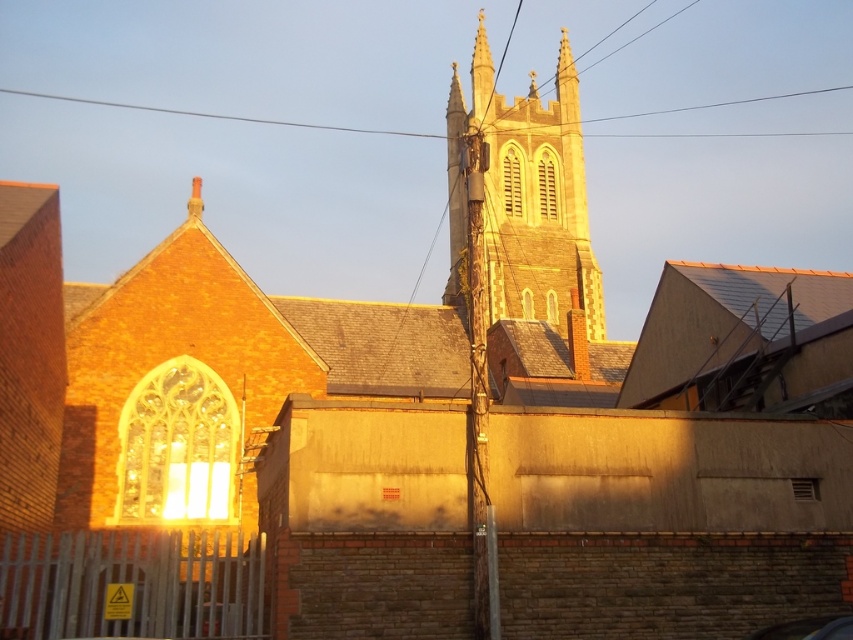
Question: Considering the relative positions of smooth wire at upper center and metallic silver car at lower right in the image provided, where is smooth wire at upper center located with respect to metallic silver car at lower right?

Choices:
 (A) below
 (B) above

Answer: (B)

Question: Among these points, which one is farthest from the camera?

Choices:
 (A) (437, 132)
 (B) (801, 131)

Answer: (B)

Question: Which object is closer to the camera taking this photo?

Choices:
 (A) metallic silver car at lower right
 (B) black wire at upper center
 (C) brown stone tower at upper center
 (D) smooth wire at upper center

Answer: (A)

Question: Can you confirm if brown stone tower at upper center is positioned to the left of black wire at upper center?

Choices:
 (A) no
 (B) yes

Answer: (A)

Question: Estimate the real-world distances between objects in this image. Which object is farther from the metallic silver car at lower right?

Choices:
 (A) smooth wire at upper center
 (B) brown stone tower at upper center
 (C) black wire at upper center

Answer: (A)

Question: Does brown stone tower at upper center appear on the right side of smooth wire at upper center?

Choices:
 (A) yes
 (B) no

Answer: (A)